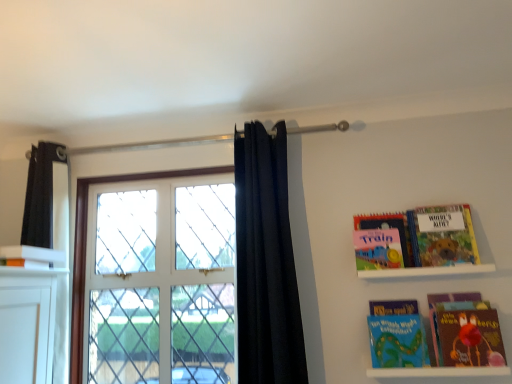
Where is `empty space that is ontop of white matte shelf at upper right, the 1th shelf viewed from the top`? This screenshot has height=384, width=512. empty space that is ontop of white matte shelf at upper right, the 1th shelf viewed from the top is located at coordinates (419, 259).